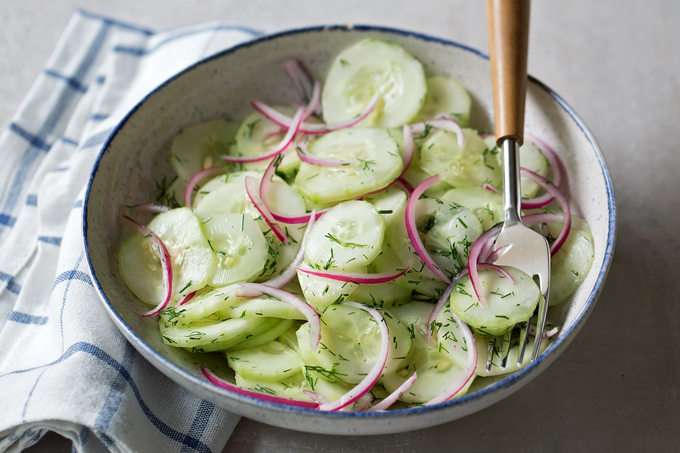
The height and width of the screenshot is (453, 680). Find the location of `bowl`. bowl is located at coordinates (130, 176).